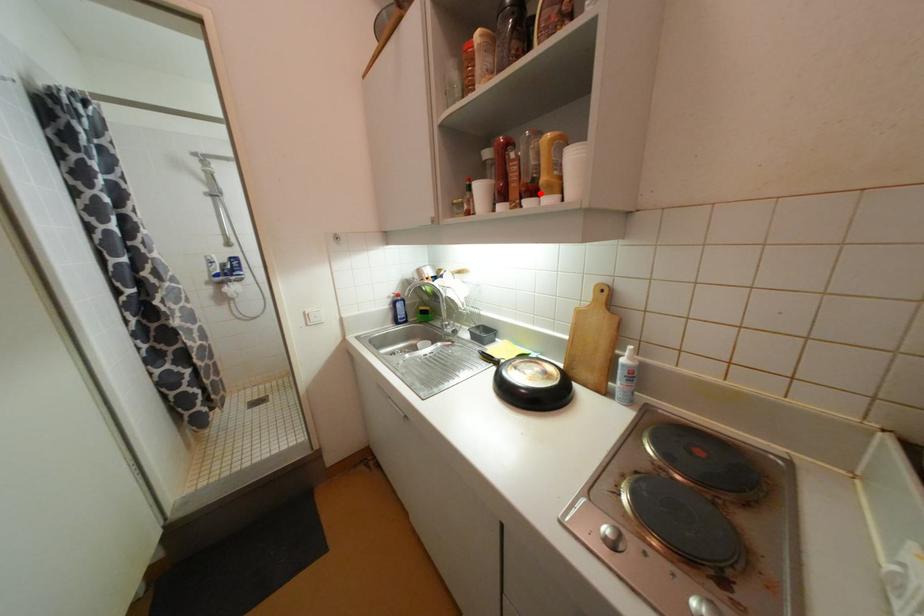
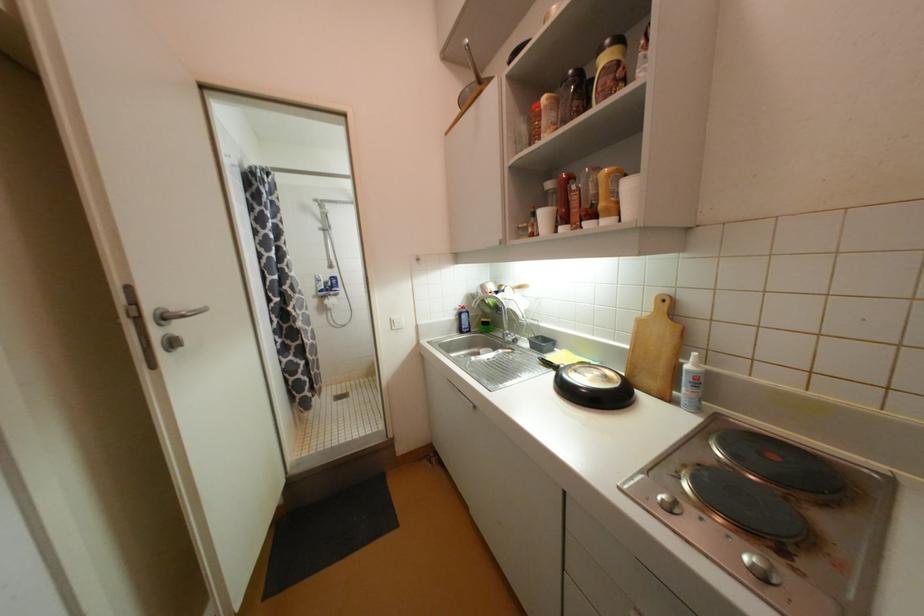
Find the pixel in the second image that matches the highlighted location in the first image.

(600, 217)